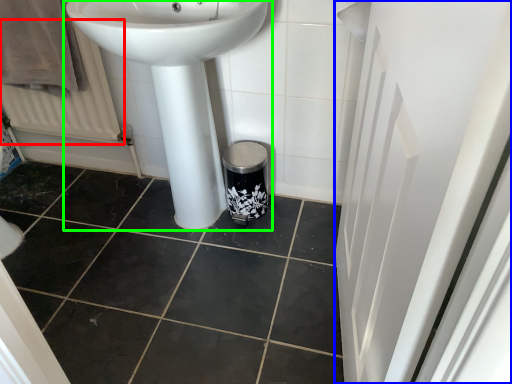
Question: Which object is the closest to the radiator (highlighted by a red box)? Choose among these: screen door (highlighted by a blue box) or sink (highlighted by a green box).

Choices:
 (A) screen door
 (B) sink

Answer: (B)